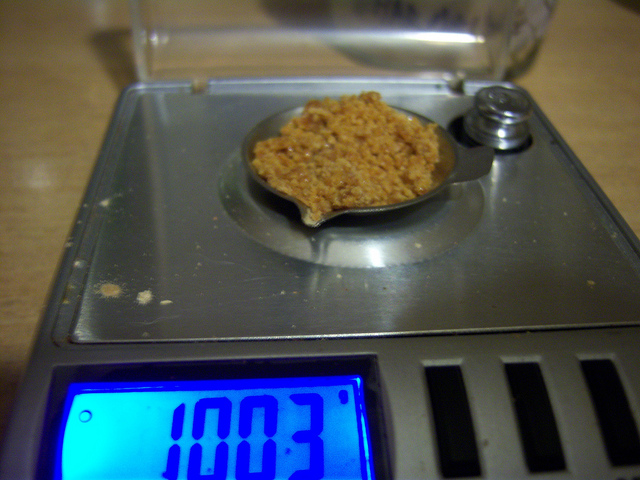
This screenshot has width=640, height=480. In order to click on black flange around bottom of silver knob in this screenshot , I will do `click(461, 136)`.